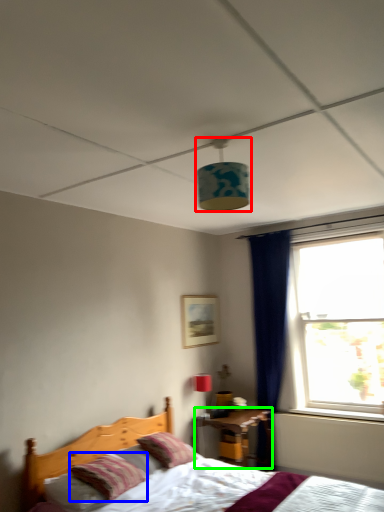
Question: Estimate the real-world distances between objects in this image. Which object is closer to lamp (highlighted by a red box), pillow (highlighted by a blue box) or nightstand (highlighted by a green box)?

Choices:
 (A) pillow
 (B) nightstand

Answer: (A)